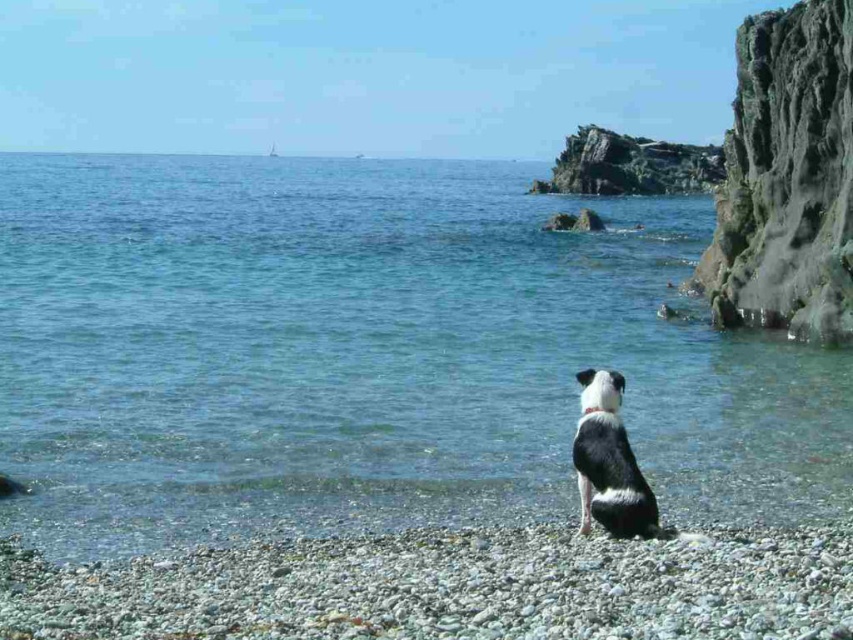
You are standing on the pebble beach and want to walk from the black and white dog to the horizon line. Which point, point (154,563) or point (830,221), is closer to you as you start walking?

Point (154,563) is closer to the viewer than point (830,221), so you would encounter point (154,563) first as you walk towards the horizon line.